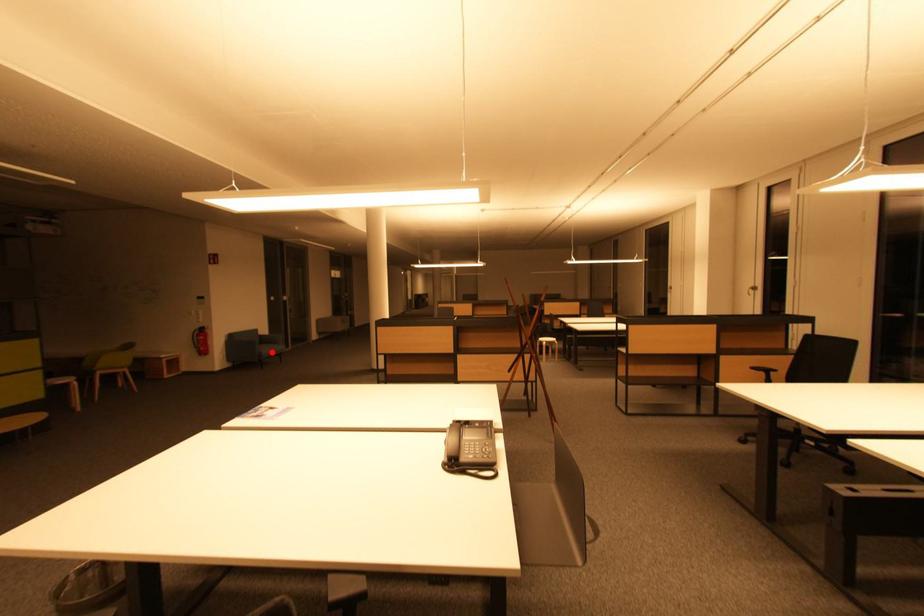
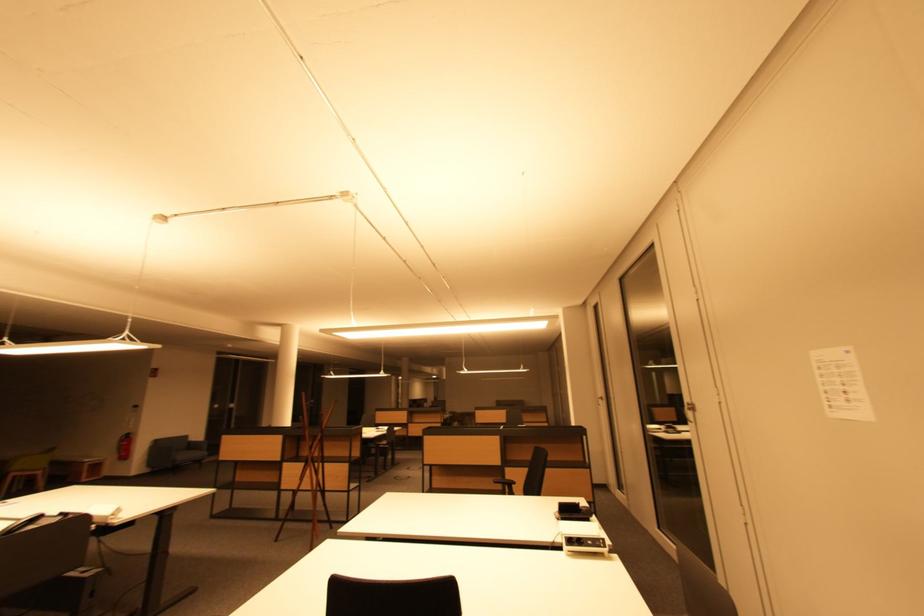
In the second image, find the point that corresponds to the highlighted location in the first image.

(188, 458)